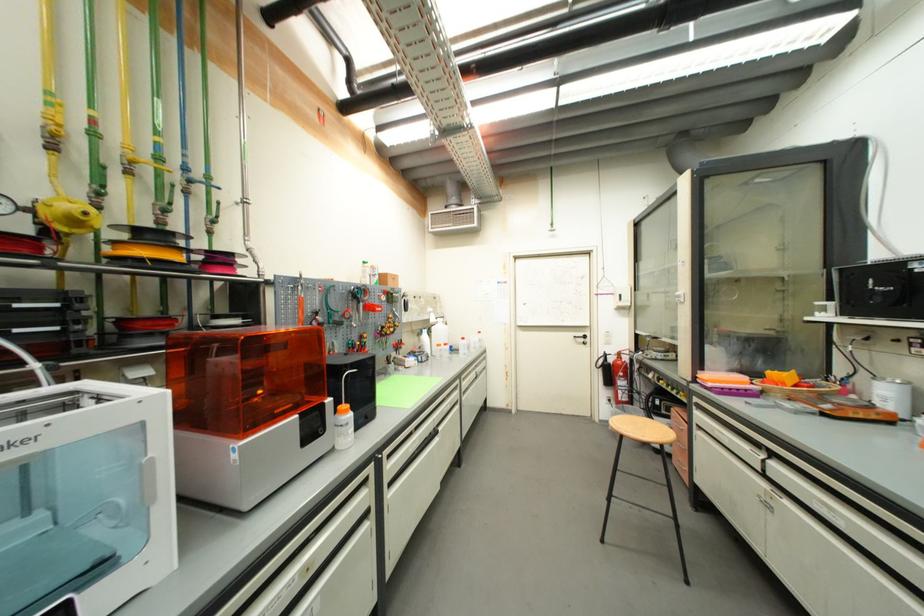
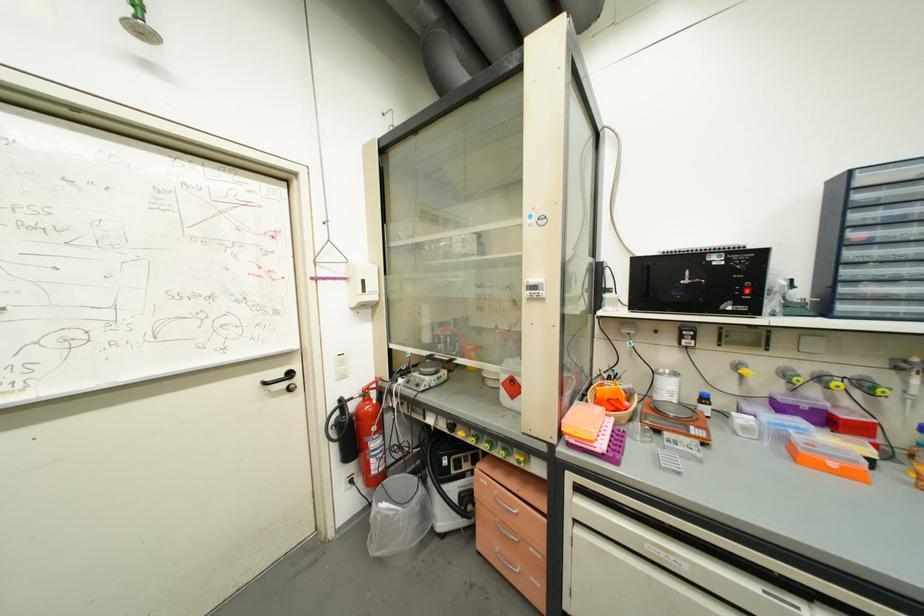
In the second image, find the point that corresponds to (764,456) in the first image.

(803, 610)